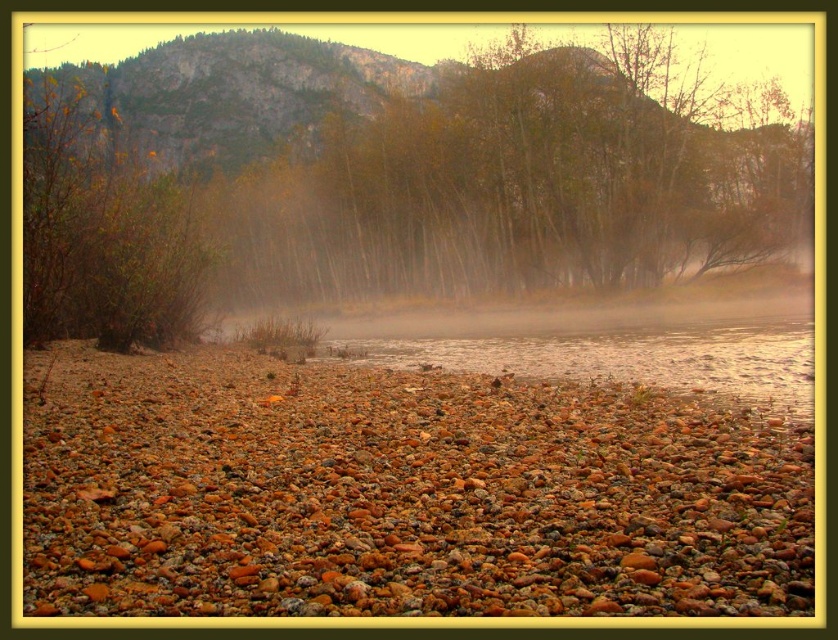
Question: Which point is farther to the camera?

Choices:
 (A) brown textured trees at center
 (B) multicolored pebbles at center

Answer: (A)

Question: Which point is farther to the camera?

Choices:
 (A) multicolored pebbles at center
 (B) brown textured trees at center

Answer: (B)

Question: Does multicolored pebbles at center have a lesser width compared to brown textured trees at center?

Choices:
 (A) yes
 (B) no

Answer: (A)

Question: Is multicolored pebbles at center above brown textured trees at center?

Choices:
 (A) yes
 (B) no

Answer: (B)

Question: Is multicolored pebbles at center positioned at the back of brown textured trees at center?

Choices:
 (A) yes
 (B) no

Answer: (B)

Question: Which of the following is the farthest from the observer?

Choices:
 (A) (249, 552)
 (B) (551, 68)

Answer: (B)